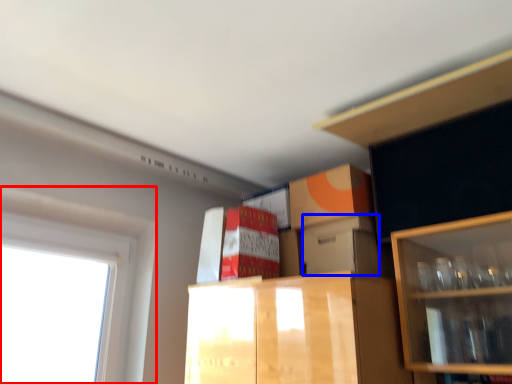
Question: Which object is closer to the camera taking this photo, window (highlighted by a red box) or storage box (highlighted by a blue box)?

Choices:
 (A) window
 (B) storage box

Answer: (A)